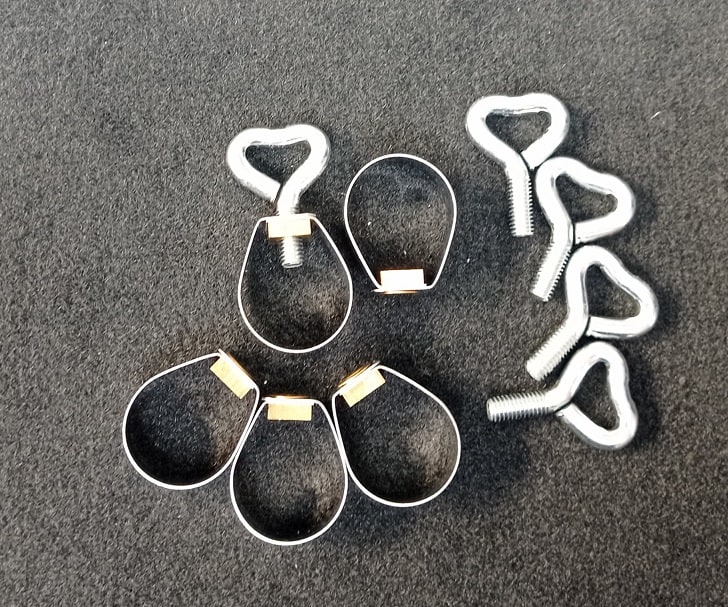
Image resolution: width=728 pixels, height=607 pixels. What are the coordinates of `screws` in the screenshot? It's located at (536, 411), (550, 348), (546, 268), (523, 204), (280, 249).